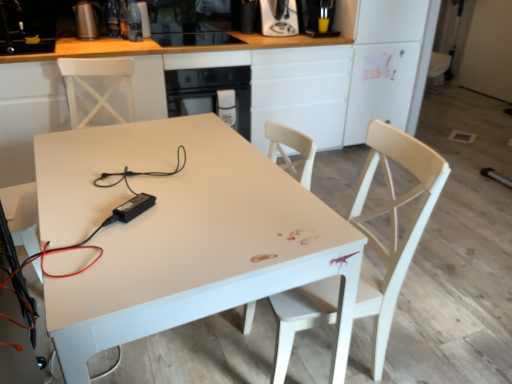
The image size is (512, 384). I want to click on vacant space underneath metallic silver kettle at upper left, which is the first appliance from left to right (from a real-world perspective), so click(92, 34).